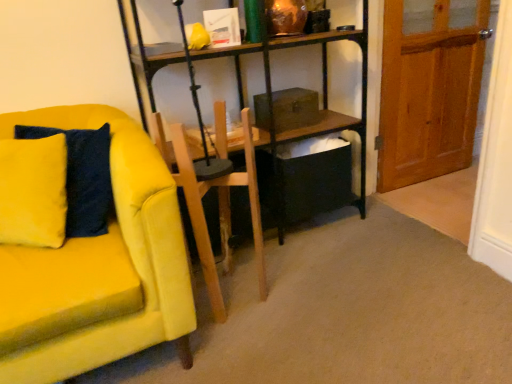
Question: Is the position of velvet yellow couch at left less distant than that of wooden armchair at center?

Choices:
 (A) yes
 (B) no

Answer: (A)

Question: Considering the relative sizes of velvet yellow couch at left and wooden armchair at center in the image provided, is velvet yellow couch at left shorter than wooden armchair at center?

Choices:
 (A) yes
 (B) no

Answer: (B)

Question: Does velvet yellow couch at left have a smaller size compared to wooden armchair at center?

Choices:
 (A) no
 (B) yes

Answer: (A)

Question: Does velvet yellow couch at left have a greater height compared to wooden armchair at center?

Choices:
 (A) no
 (B) yes

Answer: (B)

Question: Does velvet yellow couch at left have a larger size compared to wooden armchair at center?

Choices:
 (A) yes
 (B) no

Answer: (A)

Question: Is velvet yellow couch at left with wooden armchair at center?

Choices:
 (A) yes
 (B) no

Answer: (B)

Question: From a real-world perspective, does velvet yellow couch at left stand above velvet yellow pillow at left?

Choices:
 (A) no
 (B) yes

Answer: (A)

Question: Is velvet yellow pillow at left at the back of velvet yellow couch at left?

Choices:
 (A) no
 (B) yes

Answer: (B)

Question: Can you confirm if velvet yellow couch at left is smaller than velvet yellow pillow at left?

Choices:
 (A) yes
 (B) no

Answer: (B)

Question: Does velvet yellow couch at left appear on the left side of velvet yellow pillow at left?

Choices:
 (A) no
 (B) yes

Answer: (A)

Question: Is velvet yellow couch at left wider than velvet yellow pillow at left?

Choices:
 (A) yes
 (B) no

Answer: (A)

Question: Is velvet yellow couch at left taller than velvet yellow pillow at left?

Choices:
 (A) no
 (B) yes

Answer: (B)

Question: Considering the relative sizes of wooden armchair at center and velvet yellow pillow at left in the image provided, is wooden armchair at center bigger than velvet yellow pillow at left?

Choices:
 (A) no
 (B) yes

Answer: (B)